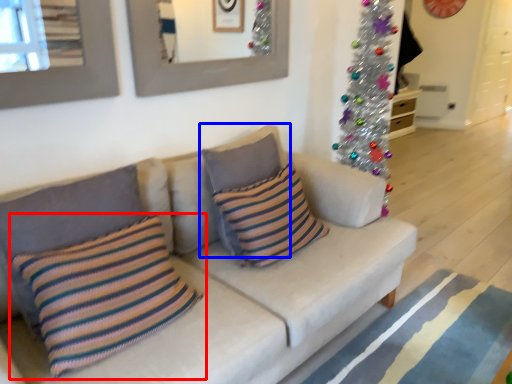
Question: Which point is further to the camera, pillow (highlighted by a red box) or pillow (highlighted by a blue box)?

Choices:
 (A) pillow
 (B) pillow

Answer: (B)